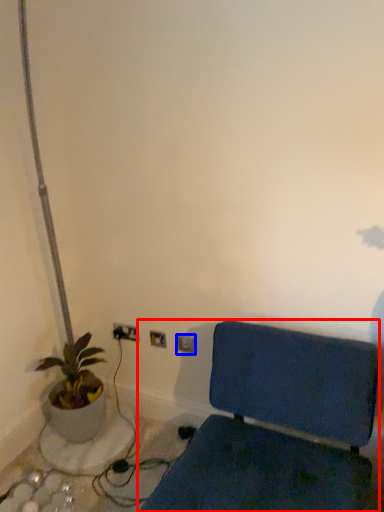
Question: Which object is closer to the camera taking this photo, furniture (highlighted by a red box) or electric outlet (highlighted by a blue box)?

Choices:
 (A) furniture
 (B) electric outlet

Answer: (A)